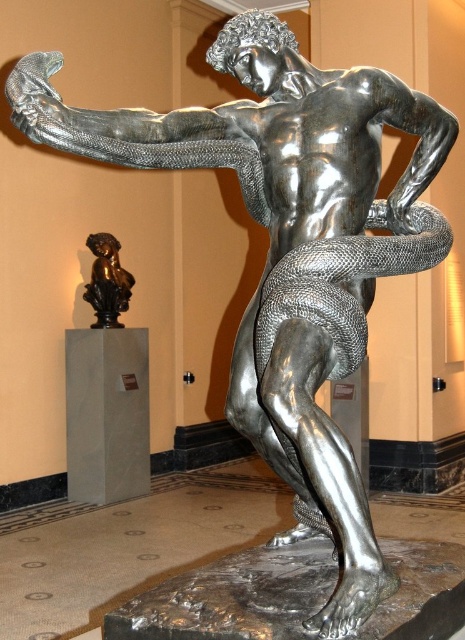
Question: Does white marble pillar at lower left appear over bronze/bronze patina cherub at lower left?

Choices:
 (A) yes
 (B) no

Answer: (B)

Question: Does white marble pillar at lower left have a greater width compared to bronze/bronze patina cherub at lower left?

Choices:
 (A) no
 (B) yes

Answer: (B)

Question: Can you confirm if white marble pillar at lower left is smaller than bronze/bronze patina cherub at lower left?

Choices:
 (A) no
 (B) yes

Answer: (A)

Question: Which point appears closest to the camera in this image?

Choices:
 (A) (93, 276)
 (B) (147, 488)

Answer: (A)

Question: Among these objects, which one is nearest to the camera?

Choices:
 (A) bronze/bronze patina cherub at lower left
 (B) white marble pillar at lower left

Answer: (B)

Question: Which point is closer to the camera?

Choices:
 (A) (78, 342)
 (B) (90, 248)

Answer: (A)